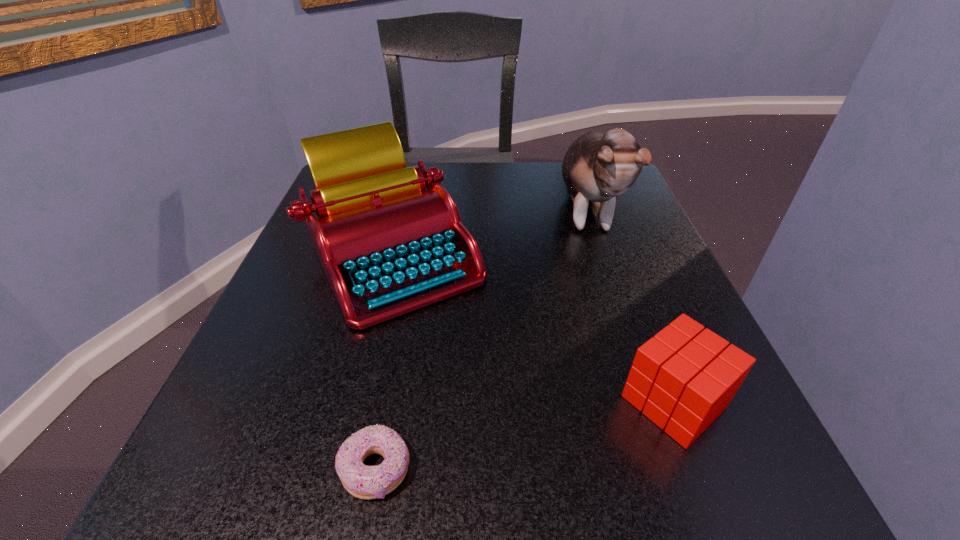
You are a GUI agent. You are given a task and a screenshot of the screen. Output one action in this format:
    pyautogui.click(x=<x>, y=<y>)
    Task: Click on the vacant space at the right edge of the desktop
    
    Given the screenshot: What is the action you would take?
    pyautogui.click(x=605, y=298)

At what (x,y) coordinates should I click in order to perform the action: click on free space at the near left corner. Please return your answer as a coordinate pair (x, y). This screenshot has height=540, width=960. Looking at the image, I should click on (270, 445).

Identify the location of vacant region at the near right corner. (634, 455).

Where is `unoccupied position between the shortest object and the typewriter`? This screenshot has width=960, height=540. unoccupied position between the shortest object and the typewriter is located at coordinates (384, 361).

Image resolution: width=960 pixels, height=540 pixels. I want to click on free space between the cat and the second tallest object, so (x=489, y=232).

Locate an element on the screen. Image resolution: width=960 pixels, height=540 pixels. free space between the tallest object and the shortest object is located at coordinates (480, 340).

I want to click on free space between the third shortest object and the tallest object, so click(489, 232).

You are a GUI agent. You are given a task and a screenshot of the screen. Output one action in this format:
    pyautogui.click(x=<x>, y=<y>)
    Task: Click on the unoccupied position between the doughnut and the second shortest object
    The image size is (960, 540).
    Given the screenshot: What is the action you would take?
    pyautogui.click(x=525, y=435)

The image size is (960, 540). I want to click on vacant space that is in between the tallest object and the cube, so click(x=630, y=306).

I want to click on blank region between the shortest object and the cube, so click(525, 435).